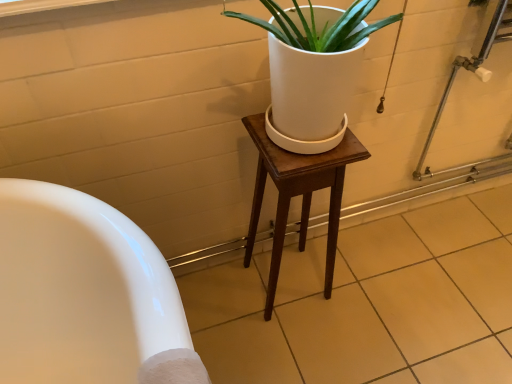
At what (x,y) coordinates should I click in order to perform the action: click on free point below wooden stool at center (from a real-world perspective). Please return your answer as a coordinate pair (x, y). This screenshot has height=384, width=512. Looking at the image, I should click on (291, 288).